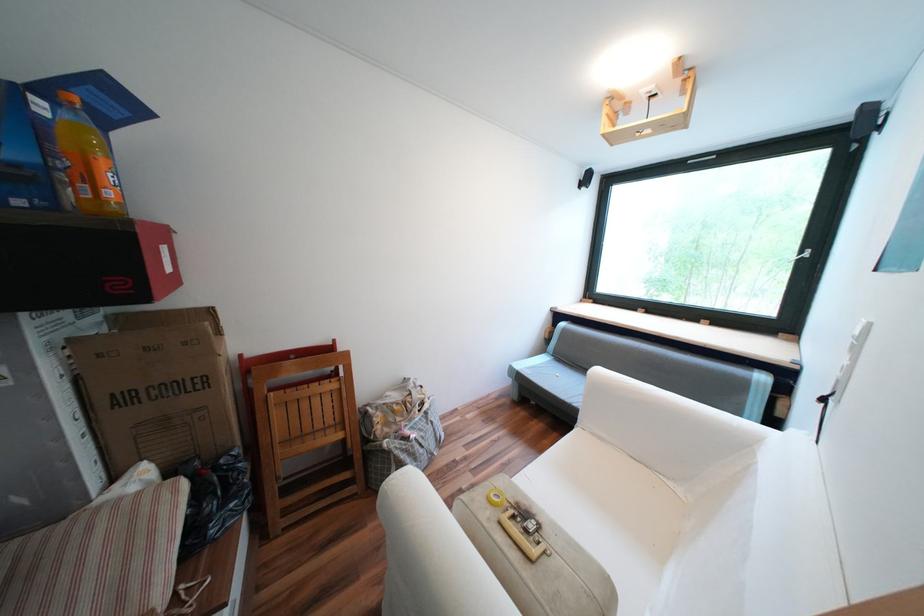
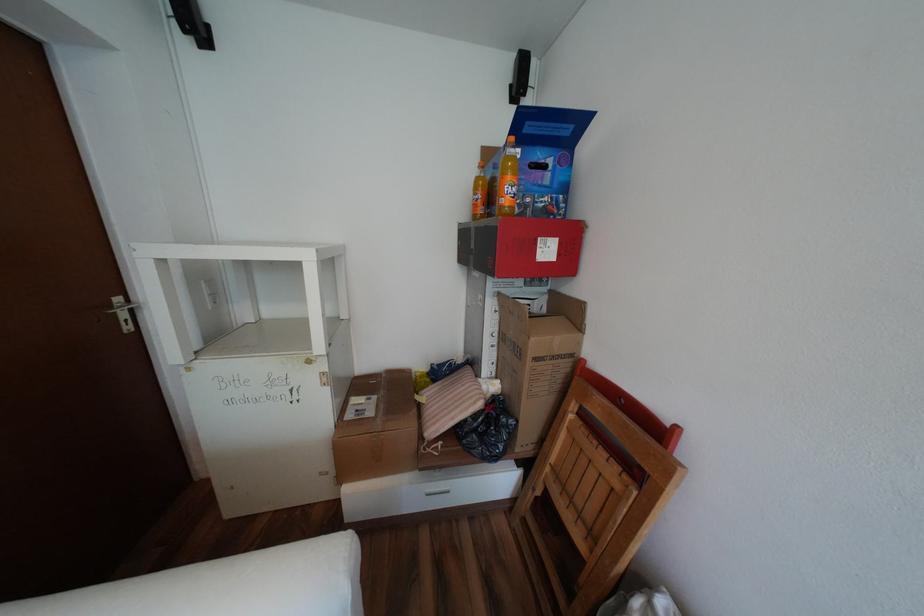
Locate, in the second image, the point that corresponds to (100,87) in the first image.

(537, 123)